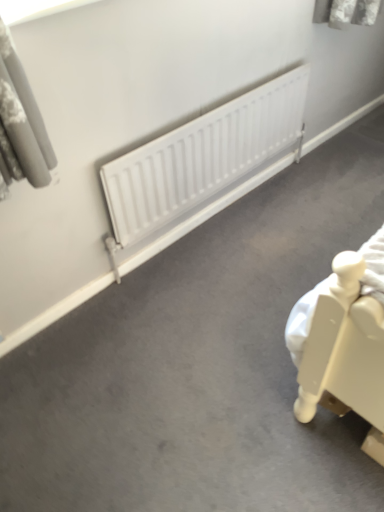
Where is `vacant space in front of white matte radiator at center`? The image size is (384, 512). vacant space in front of white matte radiator at center is located at coordinates (206, 319).